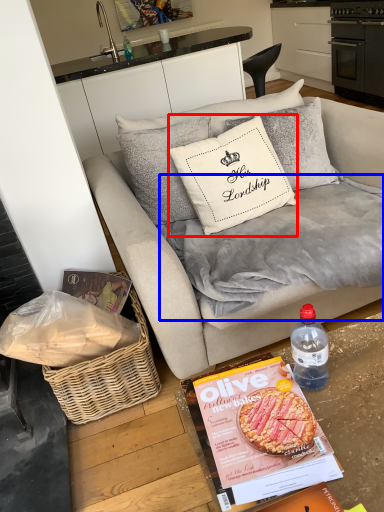
Question: Among these objects, which one is nearest to the camera, pillow (highlighted by a red box) or blanket (highlighted by a blue box)?

Choices:
 (A) pillow
 (B) blanket

Answer: (B)